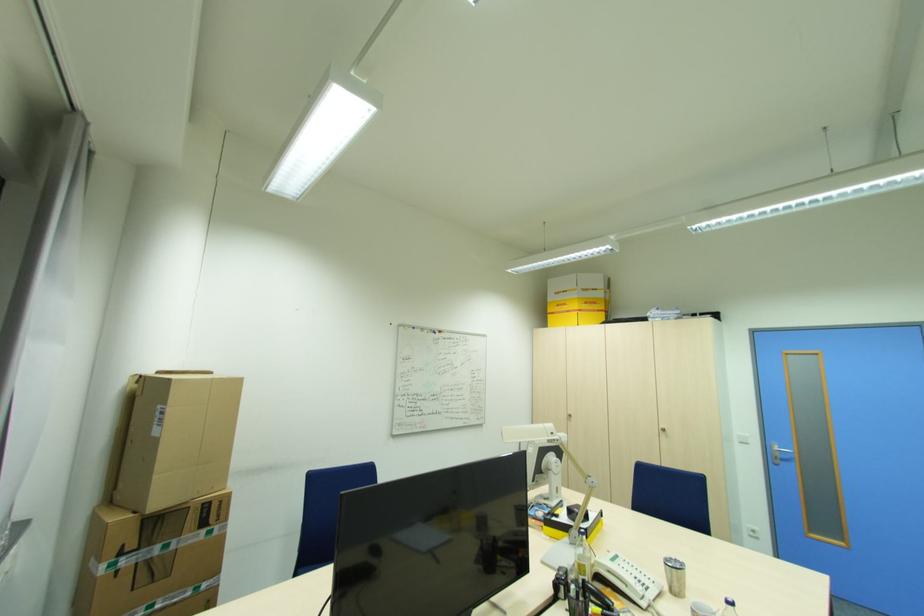
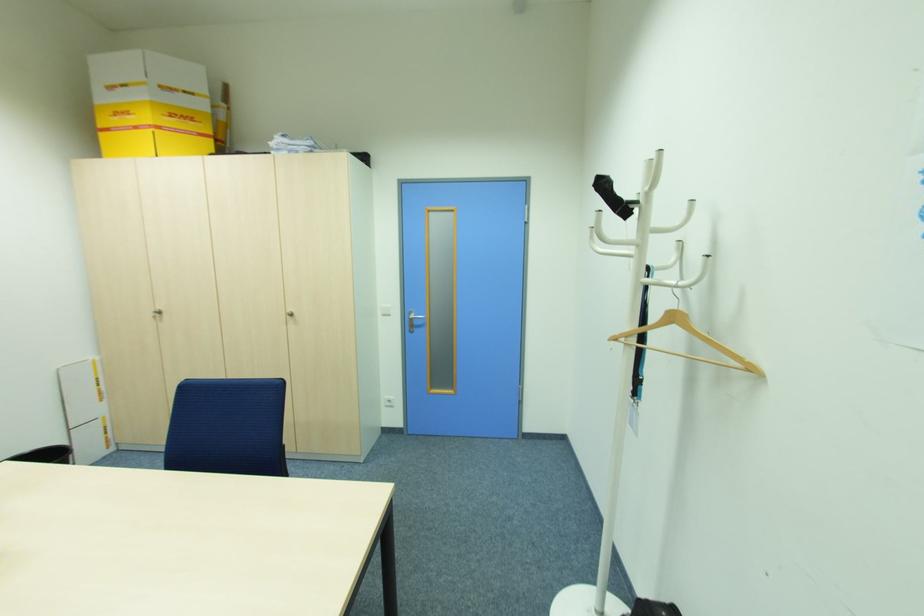
Where in the second image is the point corresponding to point (579, 297) from the first image?

(147, 95)